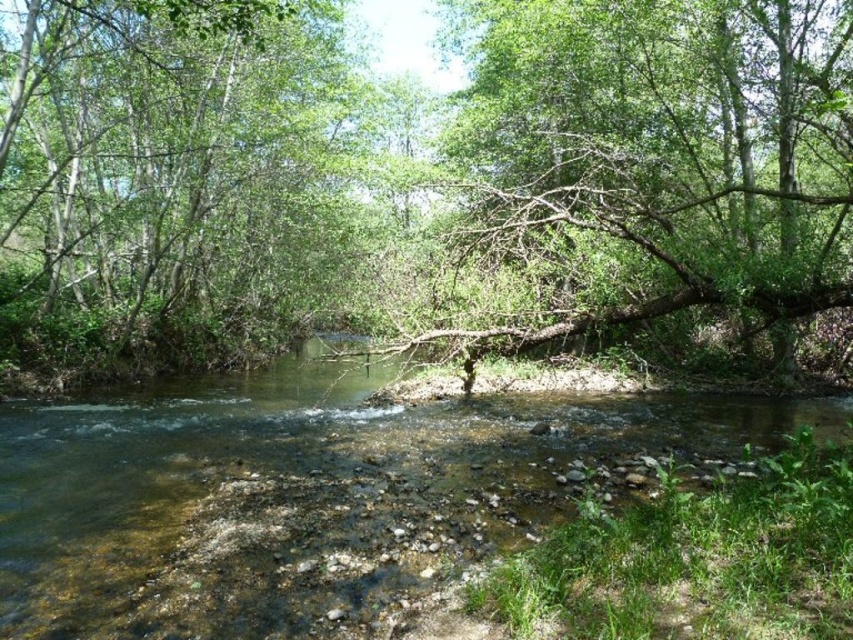
Does clear water at center have a greater height compared to green leafy tree at left?

In fact, clear water at center may be shorter than green leafy tree at left.

The height and width of the screenshot is (640, 853). What are the coordinates of `clear water at center` in the screenshot? It's located at (309, 493).

Looking at this image, can you confirm if brown rough tree trunk at center is positioned above green leafy tree at left?

No, brown rough tree trunk at center is not above green leafy tree at left.

Does brown rough tree trunk at center have a greater height compared to green leafy tree at left?

Yes.

Is point (521, 56) farther from camera compared to point (263, 100)?

No.

Locate an element on the screen. brown rough tree trunk at center is located at coordinates tap(413, 179).

Does brown rough tree trunk at center appear on the left side of clear water at center?

Indeed, brown rough tree trunk at center is positioned on the left side of clear water at center.

Does brown rough tree trunk at center have a greater width compared to clear water at center?

Yes, brown rough tree trunk at center is wider than clear water at center.

The image size is (853, 640). Find the location of `brown rough tree trunk at center`. brown rough tree trunk at center is located at coordinates (413, 179).

Locate an element on the screen. brown rough tree trunk at center is located at coordinates (413, 179).